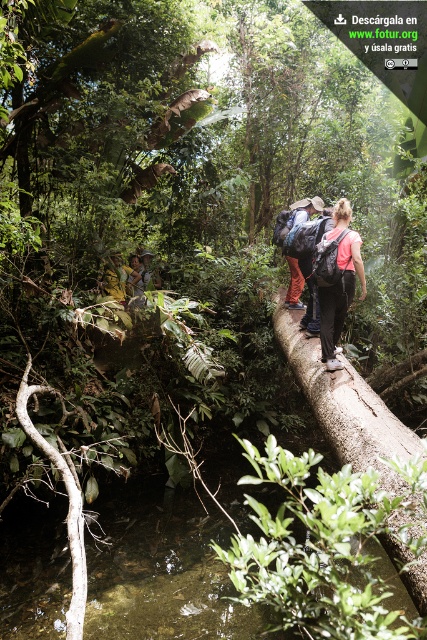
Between point (278, 317) and point (339, 328), which one is positioned in front?

Positioned in front is point (339, 328).

Who is positioned more to the left, brown rough tree trunk at center or pink fabric backpack at center?

Positioned to the left is brown rough tree trunk at center.

Where is `brown rough tree trunk at center`? brown rough tree trunk at center is located at coordinates (345, 404).

I want to click on brown rough tree trunk at center, so click(345, 404).

Is pink fabric backpack at center taller than matte brown backpack at center?

Yes, pink fabric backpack at center is taller than matte brown backpack at center.

Does point (325, 266) lie in front of point (318, 198)?

That is True.

Who is more forward, (350, 266) or (315, 205)?

Positioned in front is point (350, 266).

The image size is (427, 640). Find the location of `pink fabric backpack at center`. pink fabric backpack at center is located at coordinates tap(336, 280).

Between brown rough tree trunk at center and matte brown backpack at center, which one appears on the left side from the viewer's perspective?

From the viewer's perspective, matte brown backpack at center appears more on the left side.

Who is lower down, brown rough tree trunk at center or matte brown backpack at center?

brown rough tree trunk at center is below.

Identify the location of brown rough tree trunk at center. This screenshot has height=640, width=427. (345, 404).